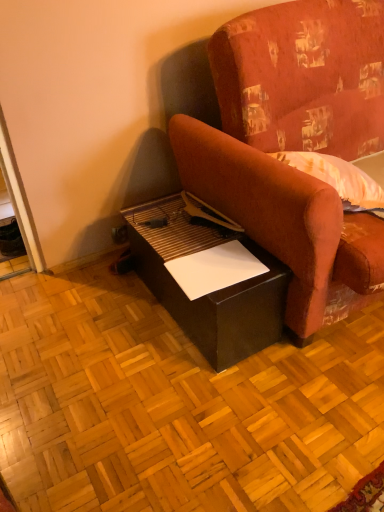
The width and height of the screenshot is (384, 512). I want to click on free space in front of matte black table at lower center, so click(x=199, y=414).